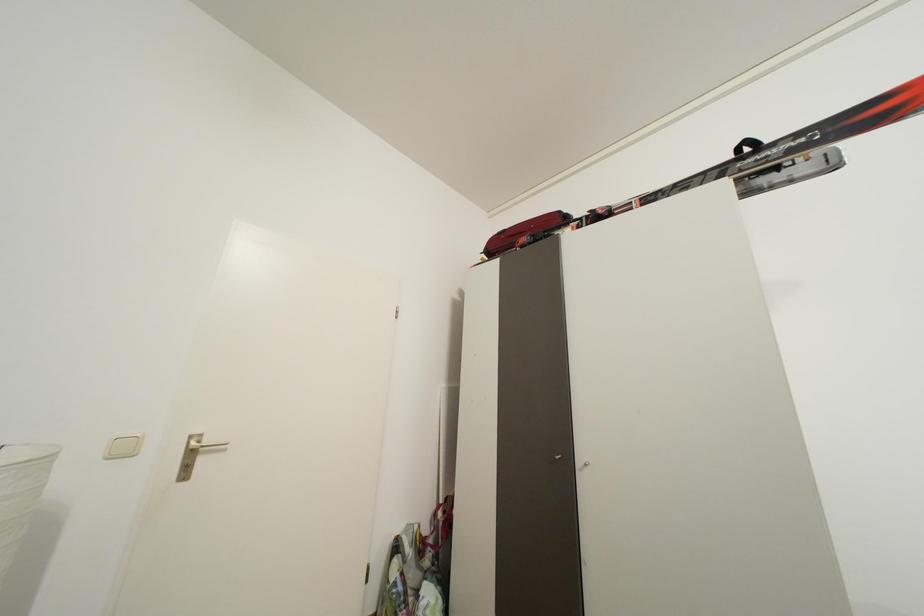
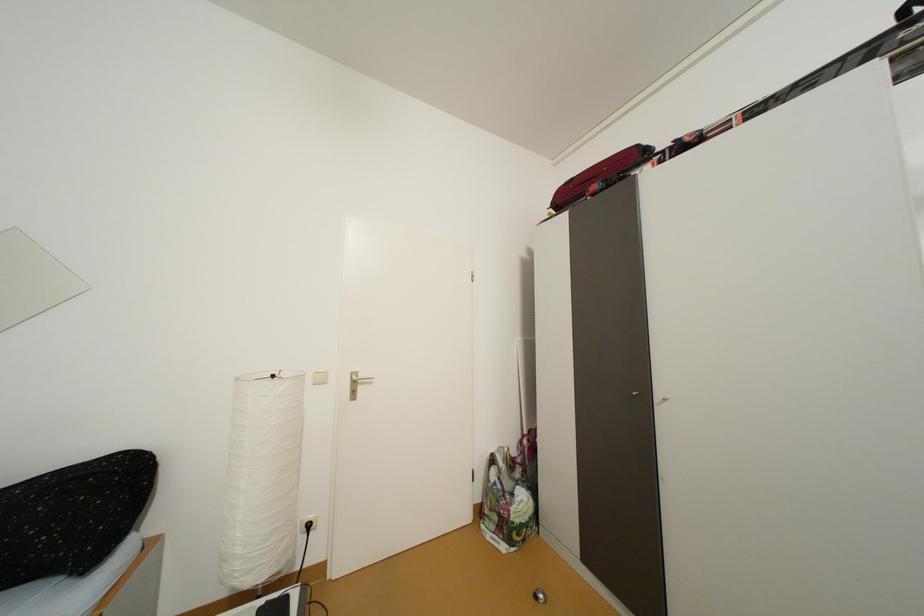
Question: How did the camera likely rotate?

Choices:
 (A) Left
 (B) Right
 (C) Up
 (D) Down

Answer: (A)